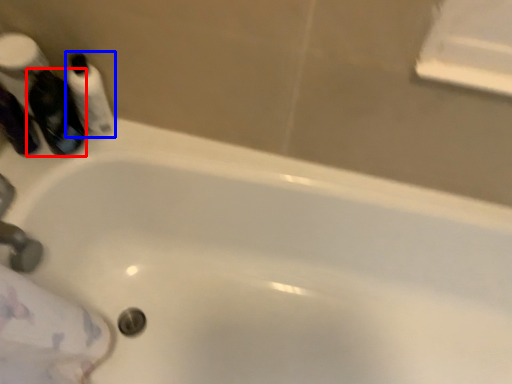
Question: Among these objects, which one is nearest to the camera, mouthwash (highlighted by a red box) or mouthwash (highlighted by a blue box)?

Choices:
 (A) mouthwash
 (B) mouthwash

Answer: (A)